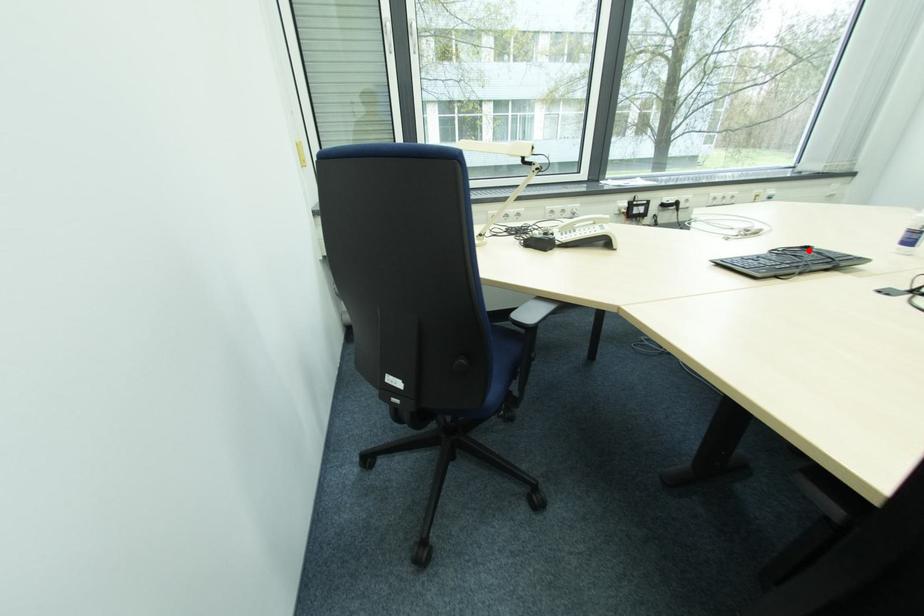
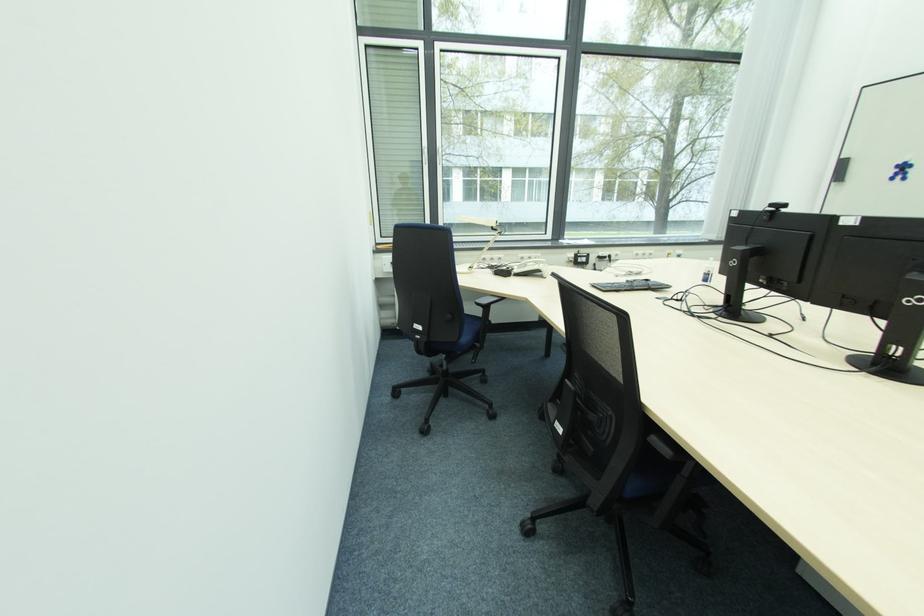
Where in the second image is the point corresponding to the highlighted location from the first image?

(650, 283)